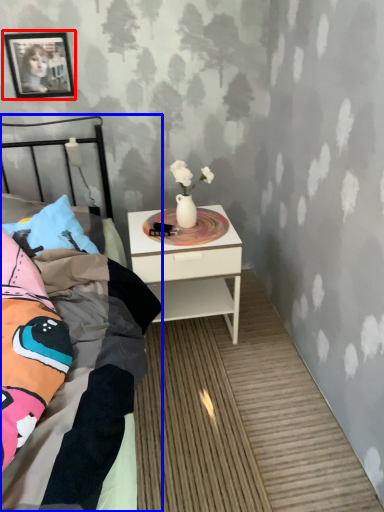
Question: Among these objects, which one is farthest to the camera, picture frame (highlighted by a red box) or bed (highlighted by a blue box)?

Choices:
 (A) picture frame
 (B) bed

Answer: (A)